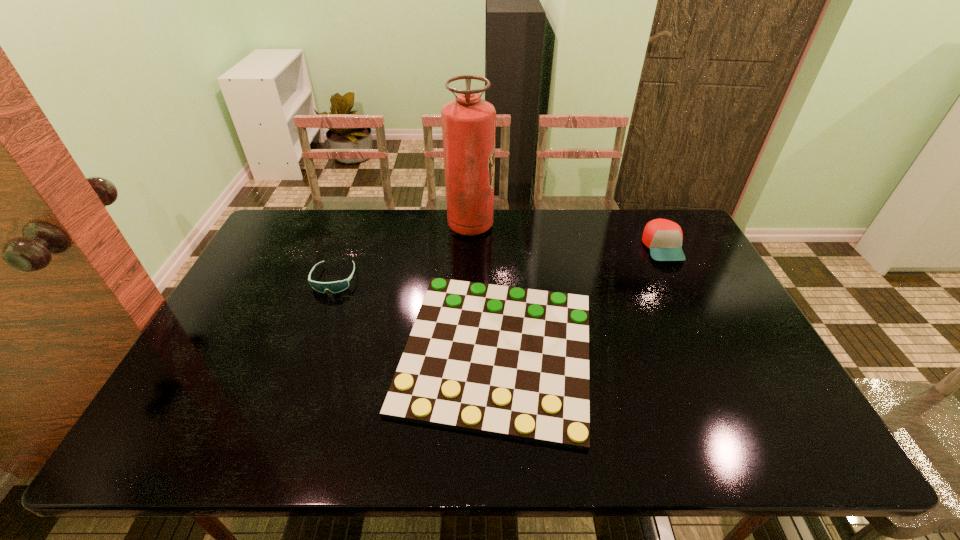
At what (x,y) coordinates should I click in order to perform the action: click on the tallest object. Please return your answer as a coordinate pair (x, y). The width and height of the screenshot is (960, 540). Looking at the image, I should click on (468, 123).

Find the location of a particular element. Image resolution: width=960 pixels, height=540 pixels. baseball cap is located at coordinates click(x=663, y=237).

This screenshot has height=540, width=960. I want to click on the second tallest object, so click(x=663, y=237).

You are a GUI agent. You are given a task and a screenshot of the screen. Output one action in this format:
    pyautogui.click(x=<x>, y=<y>)
    Task: Click on the second shortest object
    Image resolution: width=960 pixels, height=540 pixels.
    Given the screenshot: What is the action you would take?
    pyautogui.click(x=337, y=286)

At what (x,y) coordinates should I click in order to perform the action: click on goggles. Please return your answer as a coordinate pair (x, y). Looking at the image, I should click on (337, 286).

You are a GUI agent. You are given a task and a screenshot of the screen. Output one action in this format:
    pyautogui.click(x=<x>, y=<y>)
    Task: Click on the shortest object
    The image size is (960, 540).
    Given the screenshot: What is the action you would take?
    pyautogui.click(x=512, y=362)

The height and width of the screenshot is (540, 960). Find the location of `vacant space located on the label side of the tallest object`. vacant space located on the label side of the tallest object is located at coordinates (521, 226).

Locate an element on the screen. The height and width of the screenshot is (540, 960). vacant space located at the brim of the rightmost object is located at coordinates (705, 332).

I want to click on free point located 0.330m on the front-facing side of the goggles, so click(x=293, y=392).

Find the location of a particular element. free space located 0.360m on the right of the checkerboard is located at coordinates (740, 352).